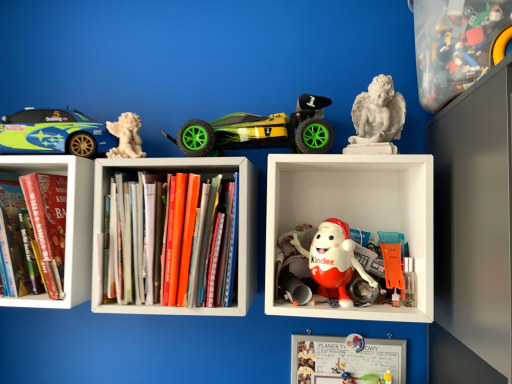
Image resolution: width=512 pixels, height=384 pixels. What do you see at coordinates (54, 133) in the screenshot?
I see `matte green and blue car at left` at bounding box center [54, 133].

What is the approximate width of whiteboard at center?

It is 2.16 inches.

You are a GUI agent. You are given a task and a screenshot of the screen. Output one action in this format:
    pyautogui.click(x=<x>, y=<y>)
    Task: Click on the matte green and blue car at left
    
    Given the screenshot: What is the action you would take?
    pyautogui.click(x=54, y=133)

Which object is further away from the camera, white plastic kinder egg at center or matte green and blue car at left?

Positioned behind is matte green and blue car at left.

From a real-world perspective, who is located higher, white plastic kinder egg at center or matte green and blue car at left?

In real-world perspective, matte green and blue car at left is above.

Does white plastic kinder egg at center have a greater height compared to matte green and blue car at left?

Correct, white plastic kinder egg at center is much taller as matte green and blue car at left.

In the image, is white plastic kinder egg at center on the left side or the right side of matte green and blue car at left?

Based on their positions, white plastic kinder egg at center is located to the right of matte green and blue car at left.

Considering the positions of objects green matte toy car at center, placed as the fourth toy when sorted from right to left, and hardcover book at left, which is counted as the 2th book, starting from the right, in the image provided, who is in front, green matte toy car at center, placed as the fourth toy when sorted from right to left, or hardcover book at left, which is counted as the 2th book, starting from the right,?

green matte toy car at center, placed as the fourth toy when sorted from right to left, is more forward.

From the image's perspective, which is above, green matte toy car at center, which is counted as the 2th toy, starting from the left, or hardcover book at left, placed as the 1th book when sorted from left to right?

green matte toy car at center, which is counted as the 2th toy, starting from the left.

Can you confirm if green matte toy car at center, placed as the fourth toy when sorted from right to left, is bigger than hardcover book at left, placed as the 1th book when sorted from left to right?

Incorrect, green matte toy car at center, placed as the fourth toy when sorted from right to left, is not larger than hardcover book at left, placed as the 1th book when sorted from left to right.

Is white marble angel at upper left, which ranks as the 1th toy in left-to-right order, taller or shorter than translucent plastic container at upper right, which is the 1th toy in right-to-left order?

In the image, white marble angel at upper left, which ranks as the 1th toy in left-to-right order, appears to be shorter than translucent plastic container at upper right, which is the 1th toy in right-to-left order.

Considering the sizes of objects white marble angel at upper left, which ranks as the 1th toy in left-to-right order, and translucent plastic container at upper right, which ranks as the 5th toy in left-to-right order, in the image provided, who is bigger, white marble angel at upper left, which ranks as the 1th toy in left-to-right order, or translucent plastic container at upper right, which ranks as the 5th toy in left-to-right order,?

Bigger between the two is translucent plastic container at upper right, which ranks as the 5th toy in left-to-right order.

Could you tell me if white marble angel at upper left, which ranks as the 1th toy in left-to-right order, is turned towards translucent plastic container at upper right, which ranks as the 5th toy in left-to-right order?

No, white marble angel at upper left, which ranks as the 1th toy in left-to-right order, is not oriented towards translucent plastic container at upper right, which ranks as the 5th toy in left-to-right order.

Is white marble angel at upper left, which ranks as the 1th toy in left-to-right order, far from translucent plastic container at upper right, which is the 1th toy in right-to-left order?

Actually, white marble angel at upper left, which ranks as the 1th toy in left-to-right order, and translucent plastic container at upper right, which is the 1th toy in right-to-left order, are a little close together.

Is hardcover book at left, placed as the 1th book when sorted from left to right, oriented away from matte plastic kinder egg at center, which is the third toy from right to left?

No, matte plastic kinder egg at center, which is the third toy from right to left, is not at the back of hardcover book at left, placed as the 1th book when sorted from left to right.

Is hardcover book at left, which is counted as the 2th book, starting from the right, inside the boundaries of matte plastic kinder egg at center, marked as the 3th toy in a left-to-right arrangement, or outside?

hardcover book at left, which is counted as the 2th book, starting from the right, lies outside matte plastic kinder egg at center, marked as the 3th toy in a left-to-right arrangement.

Is hardcover book at left, which is counted as the 2th book, starting from the right, at the right side of matte plastic kinder egg at center, marked as the 3th toy in a left-to-right arrangement?

No.

Considering the sizes of objects white marble angel at upper left, marked as the fifth toy in a right-to-left arrangement, and matte green and blue car at left in the image provided, who is taller, white marble angel at upper left, marked as the fifth toy in a right-to-left arrangement, or matte green and blue car at left?

Standing taller between the two is matte green and blue car at left.

Considering the positions of objects white marble angel at upper left, which ranks as the 1th toy in left-to-right order, and matte green and blue car at left in the image provided, who is behind, white marble angel at upper left, which ranks as the 1th toy in left-to-right order, or matte green and blue car at left?

matte green and blue car at left is more distant.

Is white marble angel at upper left, marked as the fifth toy in a right-to-left arrangement, inside the boundaries of matte green and blue car at left, or outside?

white marble angel at upper left, marked as the fifth toy in a right-to-left arrangement, is spatially situated outside matte green and blue car at left.

You are a GUI agent. You are given a task and a screenshot of the screen. Output one action in this format:
    pyautogui.click(x=<x>, y=<y>)
    Task: Click on the car that is above the white marble angel at upper left, which ranks as the 1th toy in left-to-right order (from the image's perspective)
    Image resolution: width=512 pixels, height=384 pixels.
    Given the screenshot: What is the action you would take?
    pyautogui.click(x=54, y=133)

Is point (465, 50) closer or farther from the camera than point (44, 117)?

Point (465, 50) is positioned closer to the camera compared to point (44, 117).

Is translucent plastic container at upper right, which ranks as the 5th toy in left-to-right order, wider or thinner than matte green and blue car at left?

Considering their sizes, translucent plastic container at upper right, which ranks as the 5th toy in left-to-right order, looks broader than matte green and blue car at left.

Considering the relative positions of translucent plastic container at upper right, which ranks as the 5th toy in left-to-right order, and matte green and blue car at left in the image provided, is translucent plastic container at upper right, which ranks as the 5th toy in left-to-right order, to the left or to the right of matte green and blue car at left?

Based on their positions, translucent plastic container at upper right, which ranks as the 5th toy in left-to-right order, is located to the right of matte green and blue car at left.

Does translucent plastic container at upper right, which ranks as the 5th toy in left-to-right order, have a smaller size compared to matte green and blue car at left?

No, translucent plastic container at upper right, which ranks as the 5th toy in left-to-right order, is not smaller than matte green and blue car at left.

From the image's perspective, is white marble angel at upper left, which ranks as the 1th toy in left-to-right order, under white plastic kinder egg at center?

Incorrect, from the image's perspective, white marble angel at upper left, which ranks as the 1th toy in left-to-right order, is higher than white plastic kinder egg at center.

Can you confirm if white marble angel at upper left, marked as the fifth toy in a right-to-left arrangement, is bigger than white plastic kinder egg at center?

Incorrect, white marble angel at upper left, marked as the fifth toy in a right-to-left arrangement, is not larger than white plastic kinder egg at center.

Is white marble angel at upper left, which ranks as the 1th toy in left-to-right order, positioned with its back to white plastic kinder egg at center?

white marble angel at upper left, which ranks as the 1th toy in left-to-right order, does not have its back to white plastic kinder egg at center.

Where is `car above the white plastic kinder egg at center (from a real-world perspective)`? This screenshot has height=384, width=512. car above the white plastic kinder egg at center (from a real-world perspective) is located at coordinates (54, 133).

Image resolution: width=512 pixels, height=384 pixels. There is a green matte toy car at center, which is counted as the 2th toy, starting from the left. In order to click on the 1st book below it (from the image's perspective) in this screenshot , I will do `click(48, 225)`.

Estimate the real-world distances between objects in this image. Which object is further from translucent plastic container at upper right, which is the 1th toy in right-to-left order, white plastic kinder egg at center or hardcover books at center, the 1th book in the right-to-left sequence?

hardcover books at center, the 1th book in the right-to-left sequence.

Which object lies further to the anchor point green matte toy car at center, placed as the fourth toy when sorted from right to left, hardcover books at center, which is counted as the 2th book, starting from the left, or white marble statue at upper right, placed as the 2th toy when sorted from right to left?

hardcover books at center, which is counted as the 2th book, starting from the left, lies further to green matte toy car at center, placed as the fourth toy when sorted from right to left, than the other object.

Estimate the real-world distances between objects in this image. Which object is closer to white marble angel at upper left, which ranks as the 1th toy in left-to-right order, matte green and blue car at left or green matte toy car at center, placed as the fourth toy when sorted from right to left?

matte green and blue car at left.

From the picture: When comparing their distances from white plastic kinder egg at center, does hardcover book at left, placed as the 1th book when sorted from left to right, or whiteboard at center seem further?

hardcover book at left, placed as the 1th book when sorted from left to right, is further to white plastic kinder egg at center.

Based on their spatial positions, is hardcover book at left, which is counted as the 2th book, starting from the right, or white marble angel at upper left, marked as the fifth toy in a right-to-left arrangement, further from white marble statue at upper right, acting as the 4th toy starting from the left?

The object further to white marble statue at upper right, acting as the 4th toy starting from the left, is hardcover book at left, which is counted as the 2th book, starting from the right.

Looking at the image, which one is located further to white marble angel at upper left, marked as the fifth toy in a right-to-left arrangement, matte plastic kinder egg at center, marked as the 3th toy in a left-to-right arrangement, or hardcover book at left, which is counted as the 2th book, starting from the right?

Based on the image, matte plastic kinder egg at center, marked as the 3th toy in a left-to-right arrangement, appears to be further to white marble angel at upper left, marked as the fifth toy in a right-to-left arrangement.

From the image, which object appears to be nearer to hardcover books at center, which is counted as the 2th book, starting from the left, white marble angel at upper left, marked as the fifth toy in a right-to-left arrangement, or whiteboard at center?

white marble angel at upper left, marked as the fifth toy in a right-to-left arrangement.

Looking at the image, which one is located further to matte plastic kinder egg at center, marked as the 3th toy in a left-to-right arrangement, matte green and blue car at left or hardcover book at left, which is counted as the 2th book, starting from the right?

hardcover book at left, which is counted as the 2th book, starting from the right.

This screenshot has height=384, width=512. In order to click on book located between white marble angel at upper left, marked as the fifth toy in a right-to-left arrangement, and matte plastic kinder egg at center, which is the third toy from right to left, in the left-right direction in this screenshot , I will do `click(169, 243)`.

Image resolution: width=512 pixels, height=384 pixels. What are the coordinates of `toy between hardcover book at left, placed as the 1th book when sorted from left to right, and hardcover books at center, the 1th book in the right-to-left sequence` in the screenshot? It's located at (126, 136).

The image size is (512, 384). I want to click on book situated between hardcover book at left, placed as the 1th book when sorted from left to right, and translucent plastic container at upper right, which is the 1th toy in right-to-left order, from left to right, so click(x=169, y=243).

Locate an element on the screen. toy that lies between white plastic kinder egg at center and whiteboard at center from top to bottom is located at coordinates click(333, 261).